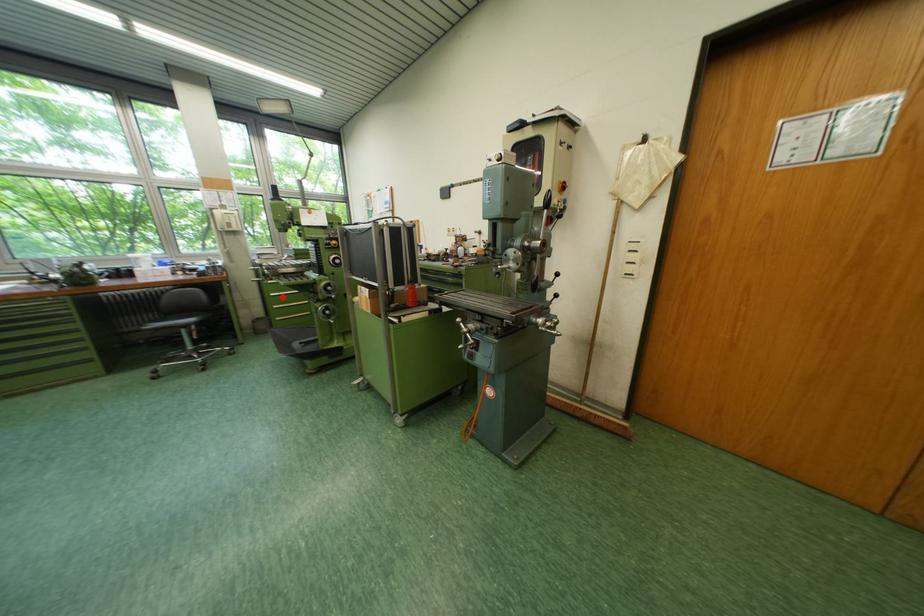
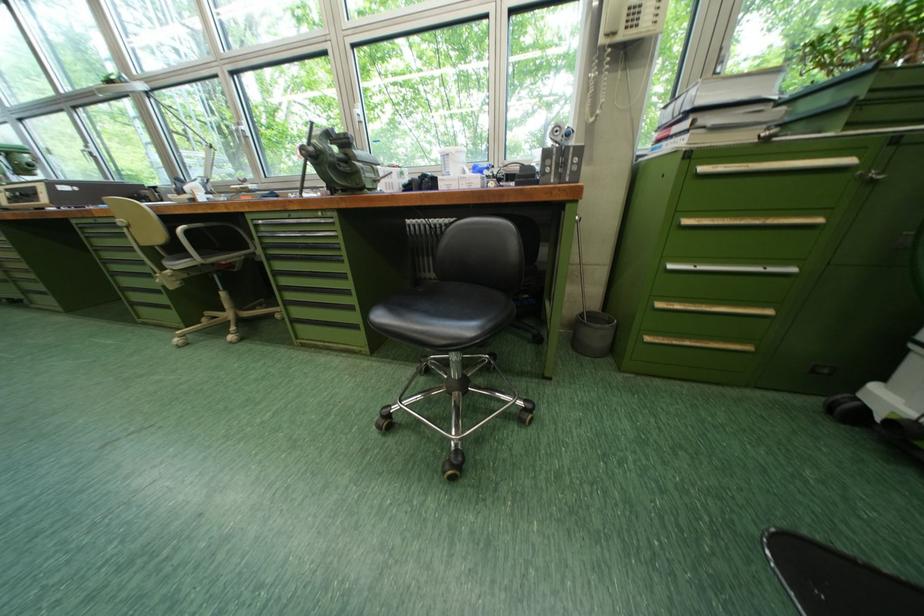
Question: I am providing you with two images of the same scene from different viewpoints. Given a red point in image1, look at the same physical point in image2. Is it:

Choices:
 (A) Closer to the viewpoint
 (B) Farther from the viewpoint

Answer: (A)